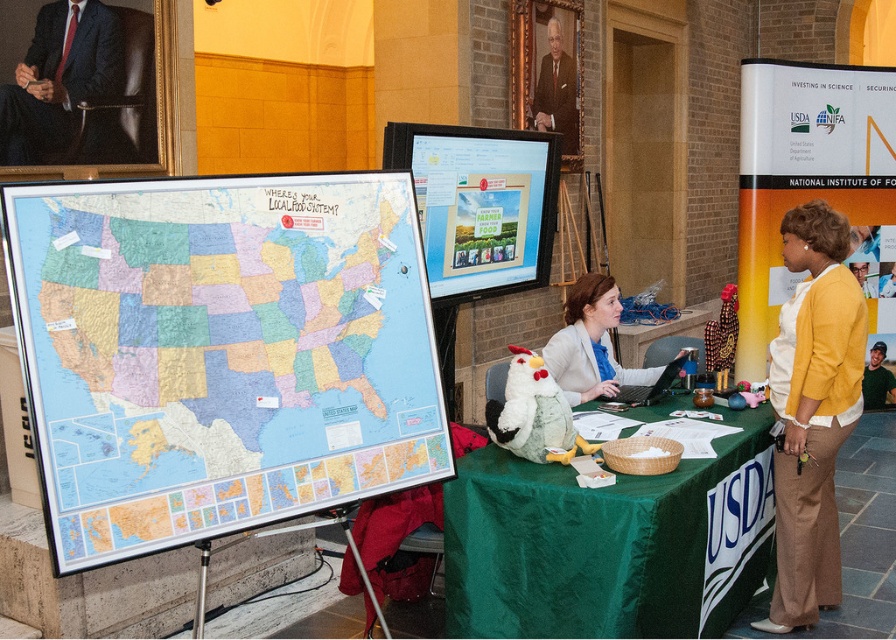
In the scene shown: You are attending a conference and see the USDA booth. You need to locate the dark suit at upper left and the green satin tablecloth at center. Which object is positioned to the right of the other?

The green satin tablecloth at center is to the right of the dark suit at upper left.